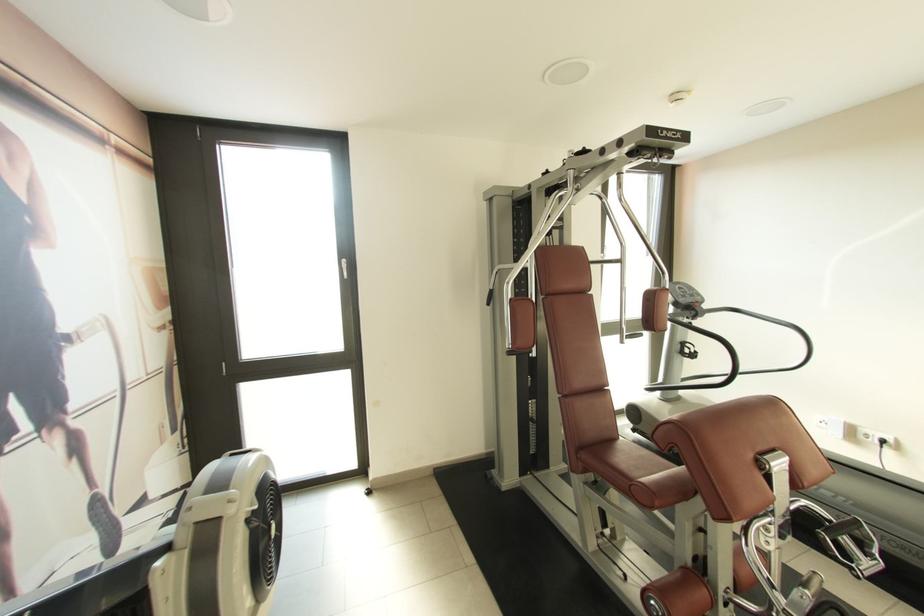
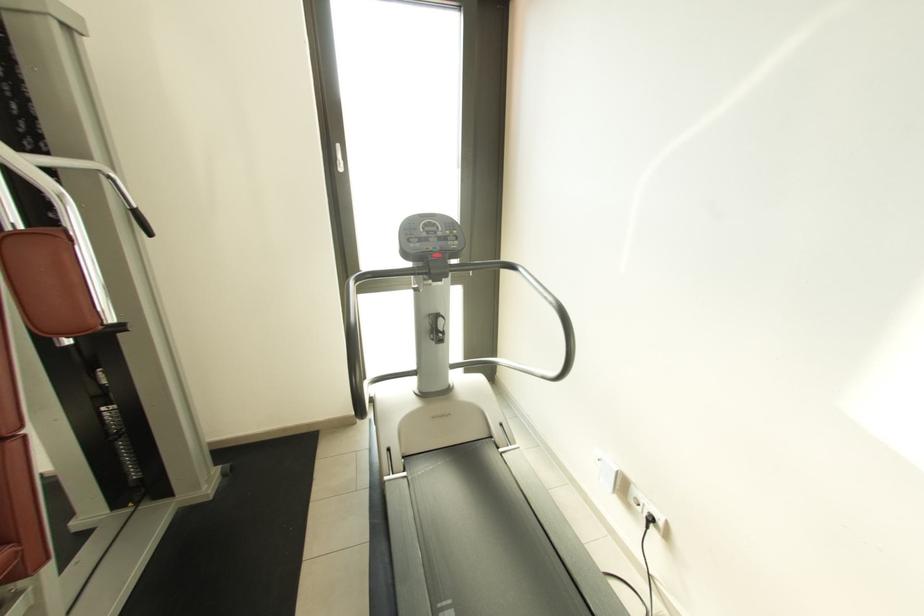
What movement of the cameraman would produce the second image?

The movement direction of the cameraman is right, forward.